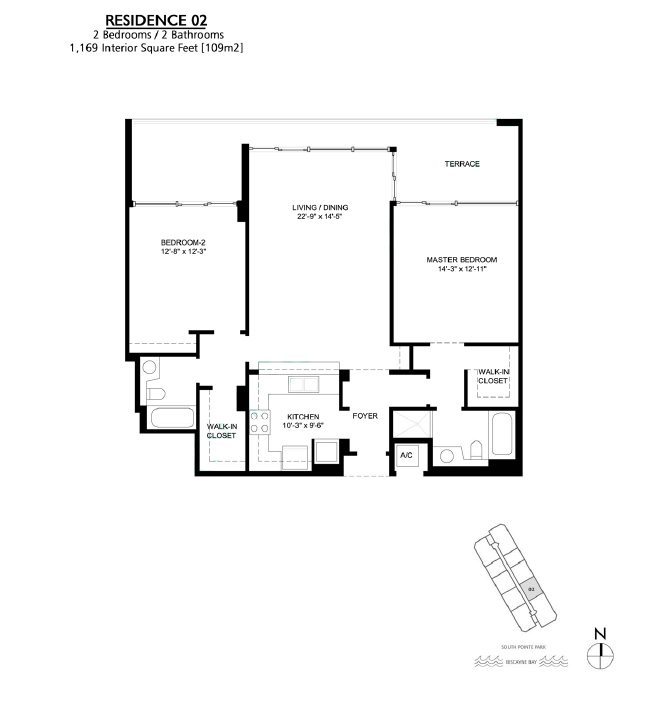
Identify the location of dimensions of living and dining room. (332, 221).